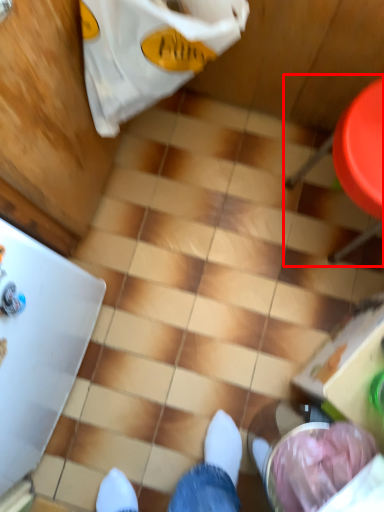
Question: Observing the image, what is the correct spatial positioning of chair (annotated by the red box) in reference to grocery bag?

Choices:
 (A) left
 (B) right

Answer: (B)